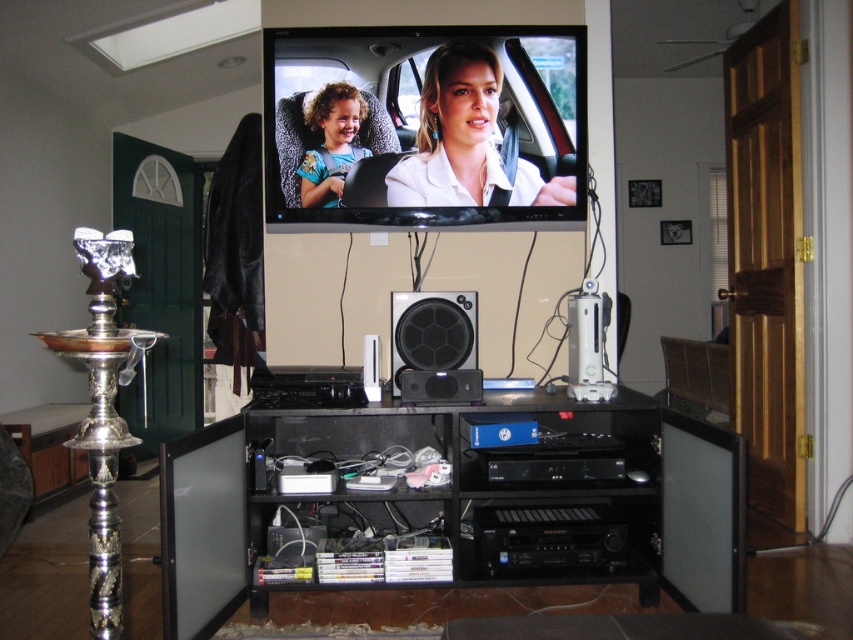
You are standing in the living room and want to place a new remote control on the black plastic flat at lower center. Based on the scene description, where exactly would you place it?

The black plastic flat at lower center is located at point (x=625, y=627), so you should place the remote control there.

Looking at this image, you are standing in the living room facing the TV. There are two points marked in the image. The first point is at coordinate point(241, 554) and the second point is at coordinate point(316, 166). Which point is closer to you?

Point(241, 554) is in front of point(316, 166), so it is closer to you.